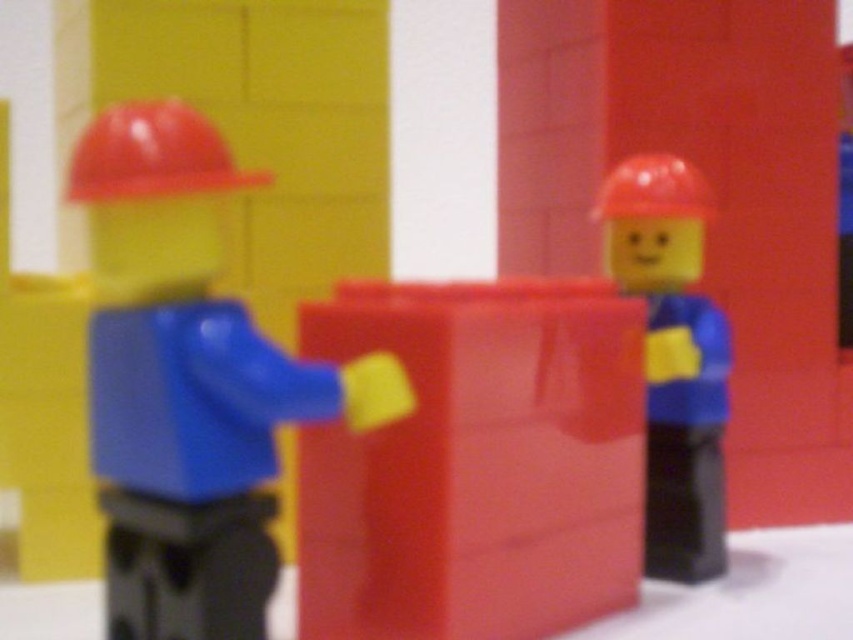
Measure the distance between matte plastic cube at center and camera.

matte plastic cube at center and camera are 26.43 inches apart.

Which is more to the right, matte plastic cube at center or matte plastic hat at center?

From the viewer's perspective, matte plastic hat at center appears more on the right side.

Between point (532, 560) and point (627, 161), which one is positioned behind?

The point (627, 161) is more distant.

The image size is (853, 640). What are the coordinates of `matte plastic cube at center` in the screenshot? It's located at (476, 464).

Is matte plastic cube at center to the left of matte plastic hard hat at upper left from the viewer's perspective?

In fact, matte plastic cube at center is to the right of matte plastic hard hat at upper left.

Does matte plastic cube at center appear under matte plastic hard hat at upper left?

Yes, matte plastic cube at center is below matte plastic hard hat at upper left.

Does point (302, 308) come in front of point (165, 115)?

No, (302, 308) is behind (165, 115).

Identify the location of matte plastic cube at center. The width and height of the screenshot is (853, 640). (476, 464).

Who is higher up, matte plastic construction worker at left or matte plastic hat at center?

Positioned higher is matte plastic hat at center.

Can you confirm if matte plastic construction worker at left is thinner than matte plastic hat at center?

No.

This screenshot has height=640, width=853. Describe the element at coordinates (190, 384) in the screenshot. I see `matte plastic construction worker at left` at that location.

I want to click on matte plastic construction worker at left, so click(190, 384).